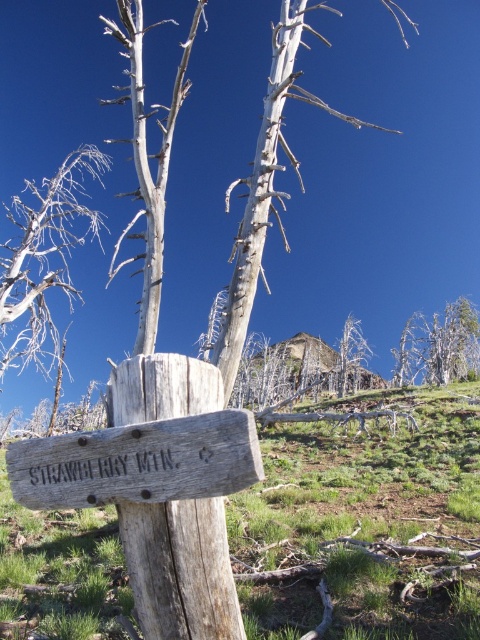
The image size is (480, 640). I want to click on green rough wood sign at center, so click(x=364, y=524).

Is green rough wood sign at center to the left of dead wood tree at center from the viewer's perspective?

Correct, you'll find green rough wood sign at center to the left of dead wood tree at center.

Locate an element on the screen. green rough wood sign at center is located at coordinates (364, 524).

Identify the location of green rough wood sign at center. (364, 524).

Between point (252, 289) and point (396, 384), which one is positioned in front?

Point (252, 289)

Locate an element on the screen. The image size is (480, 640). dead wood tree at center is located at coordinates (265, 186).

Is point (228, 305) in front of point (435, 356)?

Yes.

The image size is (480, 640). What are the coordinates of `dead wood tree at center` in the screenshot? It's located at (265, 186).

Is gray wood tree at left above dead wood tree at center?

Answer: Incorrect, gray wood tree at left is not positioned above dead wood tree at center.

Is gray wood tree at left wider than dead wood tree at center?

No, gray wood tree at left is not wider than dead wood tree at center.

Which is behind, point (38, 323) or point (275, 120)?

Point (38, 323)

Find the location of a particular element. The image size is (480, 640). gray wood tree at left is located at coordinates (45, 259).